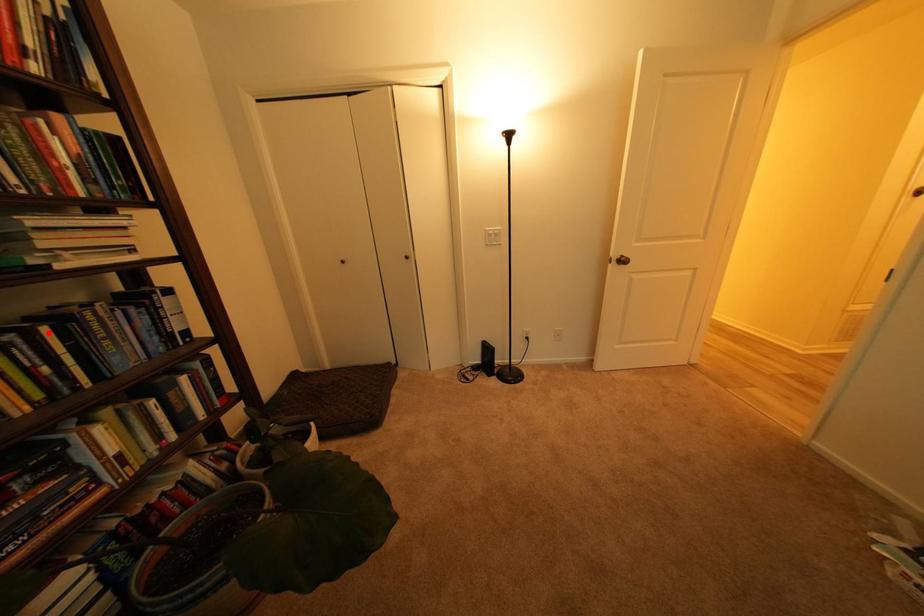
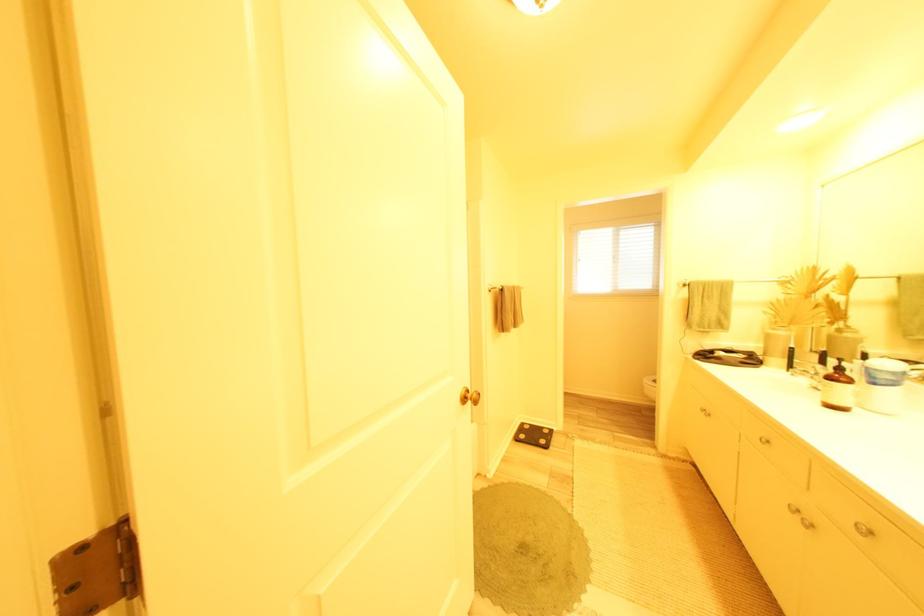
Question: I am providing you with two images of the same scene from different viewpoints. A red point is marked on the first image. Can you still see the location of the red point in image 2?

Choices:
 (A) Yes
 (B) No

Answer: (B)